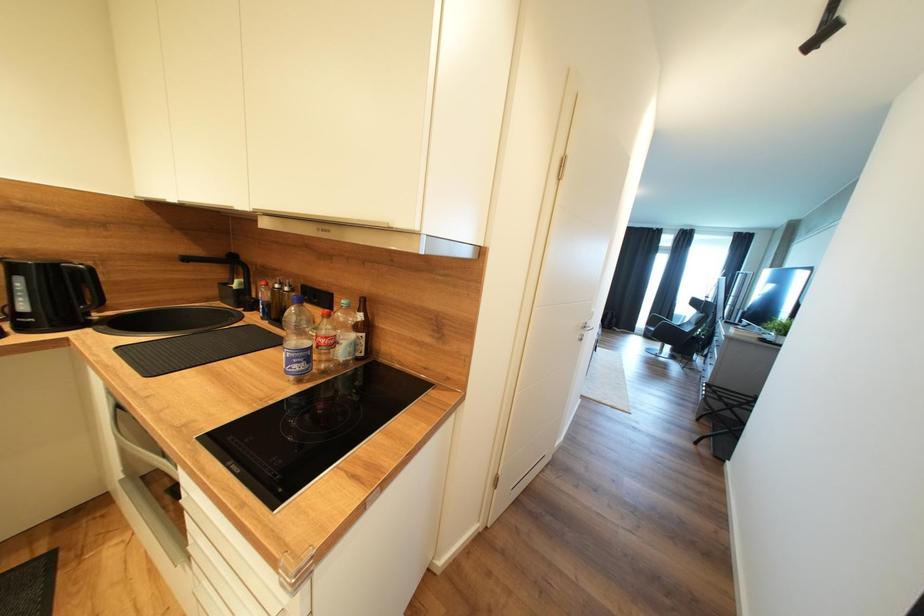
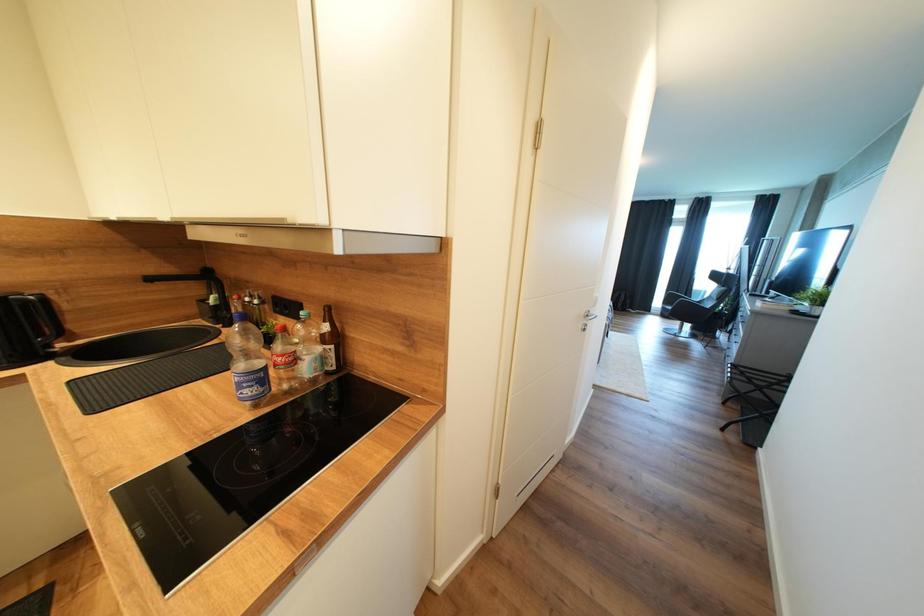
Question: How did the camera likely rotate?

Choices:
 (A) Left
 (B) Right
 (C) Up
 (D) Down

Answer: (A)